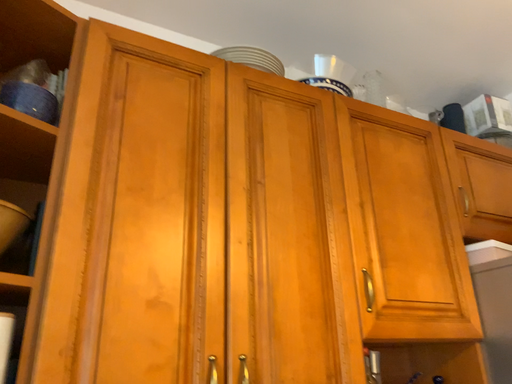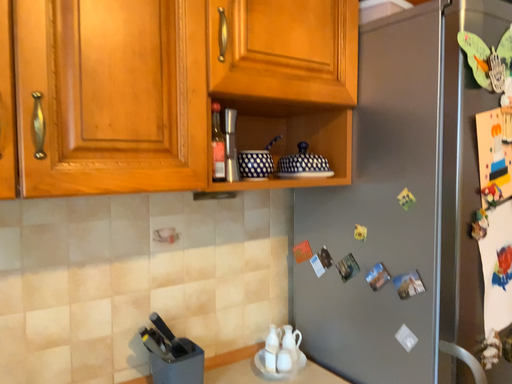
Question: How did the camera likely rotate when shooting the video?

Choices:
 (A) rotated upward
 (B) rotated downward

Answer: (B)